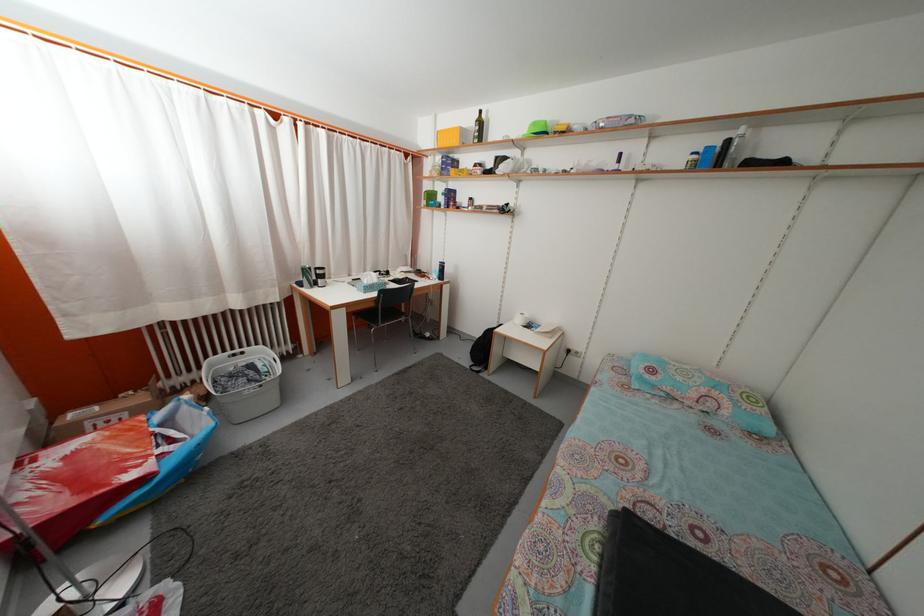
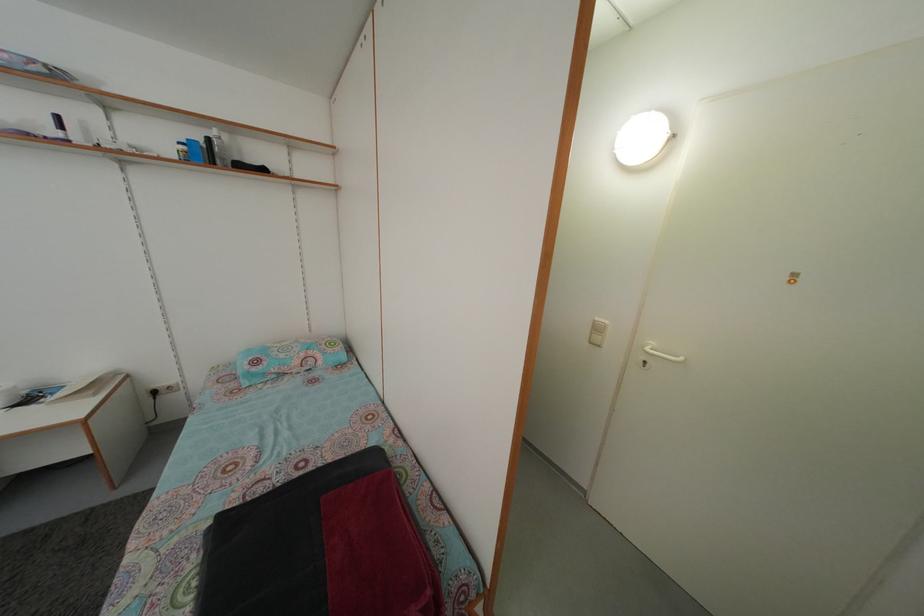
In the second image, find the point that corresponds to [734,148] in the first image.

(214, 148)